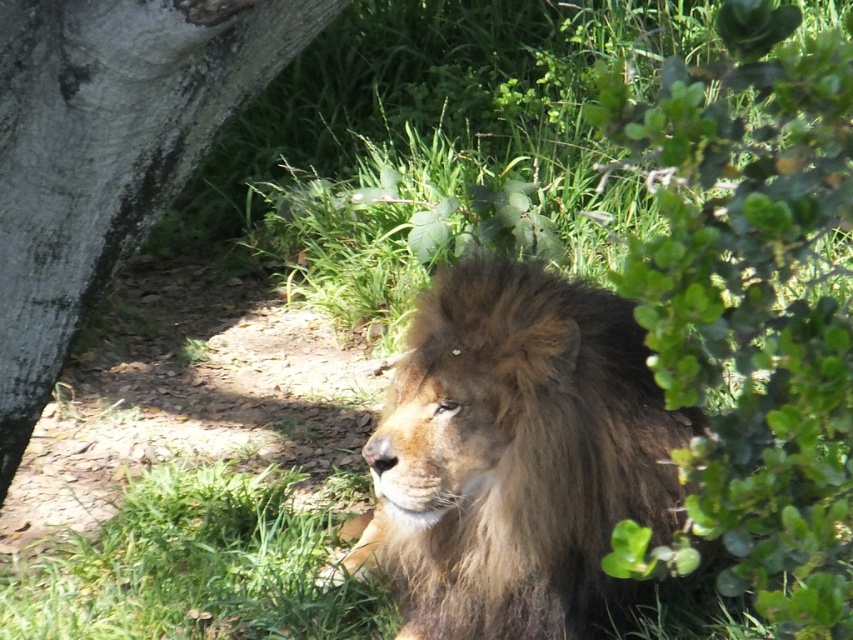
You are standing at the center of the image and want to move towards the green leafy bush at right. Which direction should you turn to face the bush?

The green leafy bush at right is located to your right side, so you should turn to your right to face it.

You are a photographer trying to capture the lion in the scene. You notice two points marked in the image. The first point is at coordinate point (495, 550) and the second is at point (15, 458). If you want to focus on the point closer to you, which coordinate should you adjust your camera to?

Point (15, 458) is closer to you than point (495, 550), so you should adjust your camera to focus on point (15, 458).